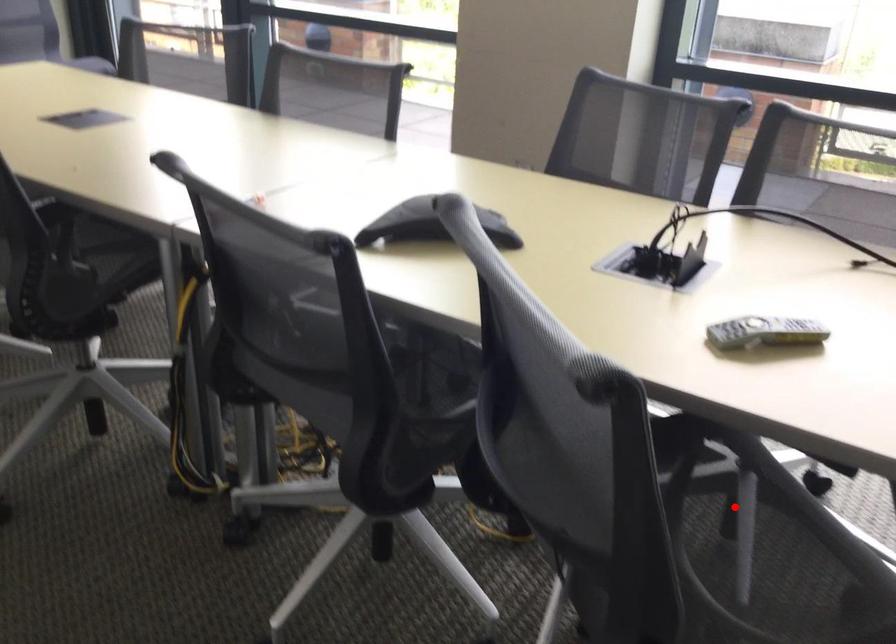
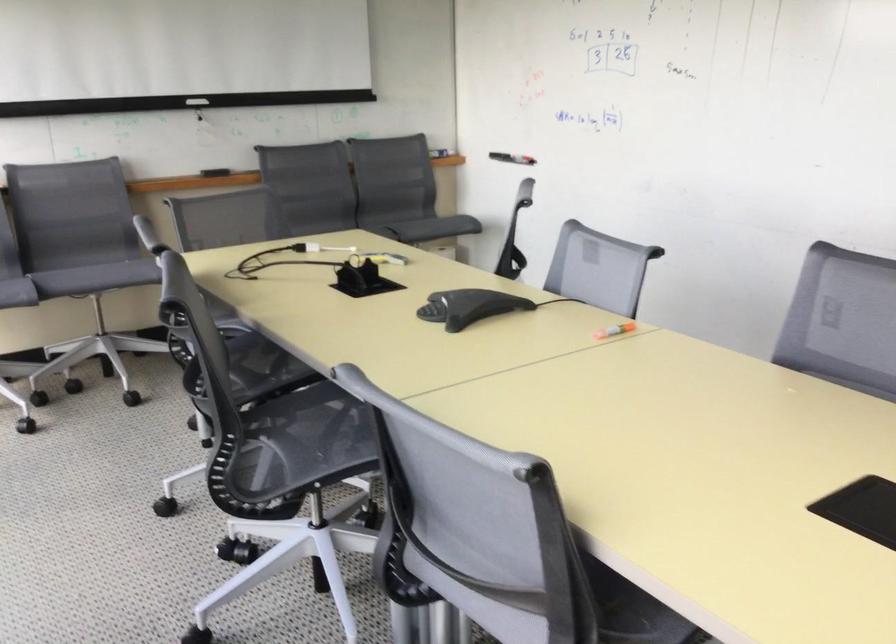
Question: I am providing you with two images of the same scene from different viewpoints. A red point is marked on the first image. Can you still see the location of the red point in image 2?

Choices:
 (A) Yes
 (B) No

Answer: (B)